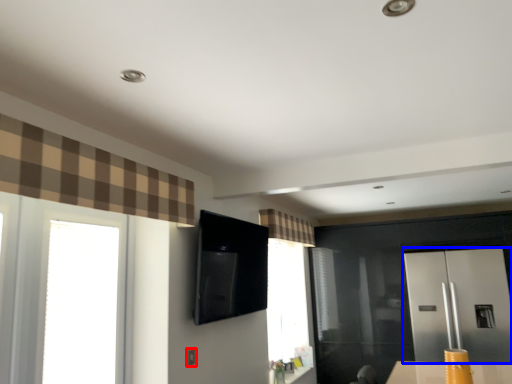
Question: Which object is further to the camera taking this photo, electric outlet (highlighted by a red box) or screen door (highlighted by a blue box)?

Choices:
 (A) electric outlet
 (B) screen door

Answer: (B)